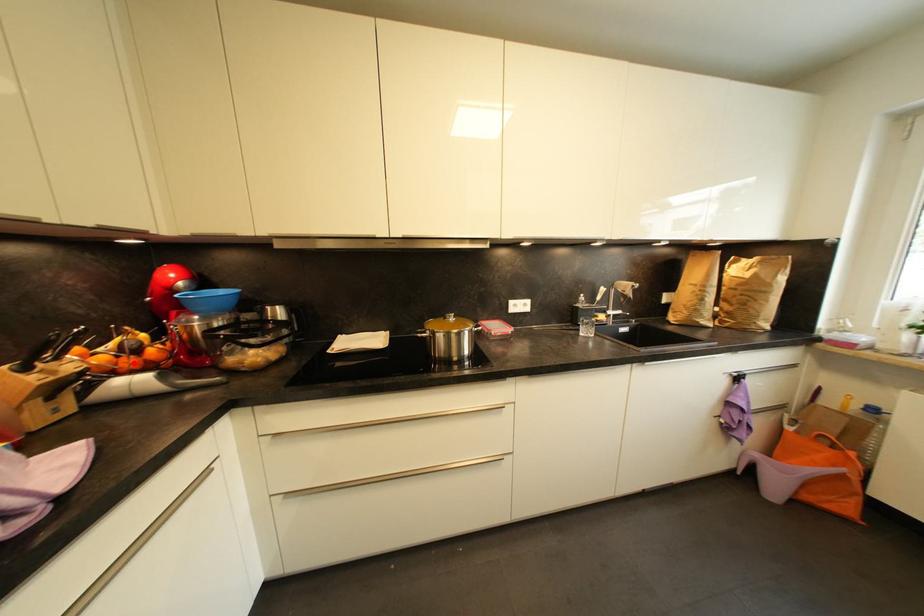
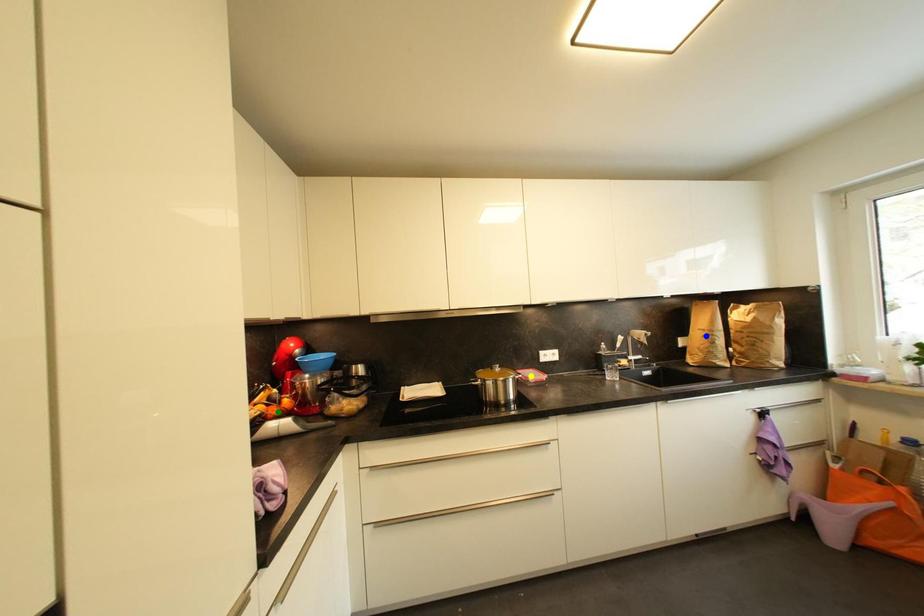
Question: I am providing you with two images of the same scene from different viewpoints. A red point is marked on the first image. You are given multiple points on the second image. Which point in image 2 is actually the same real-world point as the red point in image 1?

Choices:
 (A) green point
 (B) blue point
 (C) yellow point

Answer: (A)